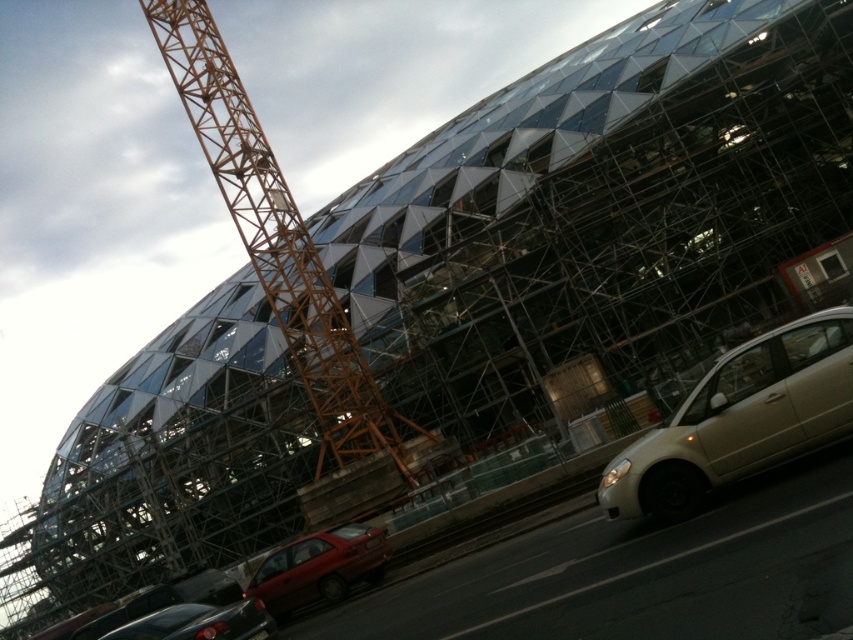
You are a pedestrian standing on the sidewalk in front of the construction site. You notice two cars parked at lower left. Which car is closer to the building, the shiny red sedan at lower left or the shiny black sedan at lower left?

The shiny black sedan at lower left is closer to the building because it is positioned to the left of the shiny red sedan at lower left, which is further to the right.

You are a delivery driver who needs to park your vehicle in the parking spot near the construction site. You see two cars parked there, a shiny red sedan at lower left and a shiny black sedan at lower left. Which car takes up less space in the parking spot?

The shiny red sedan at lower left has a smaller size compared to the shiny black sedan at lower left, so it takes up less space in the parking spot.